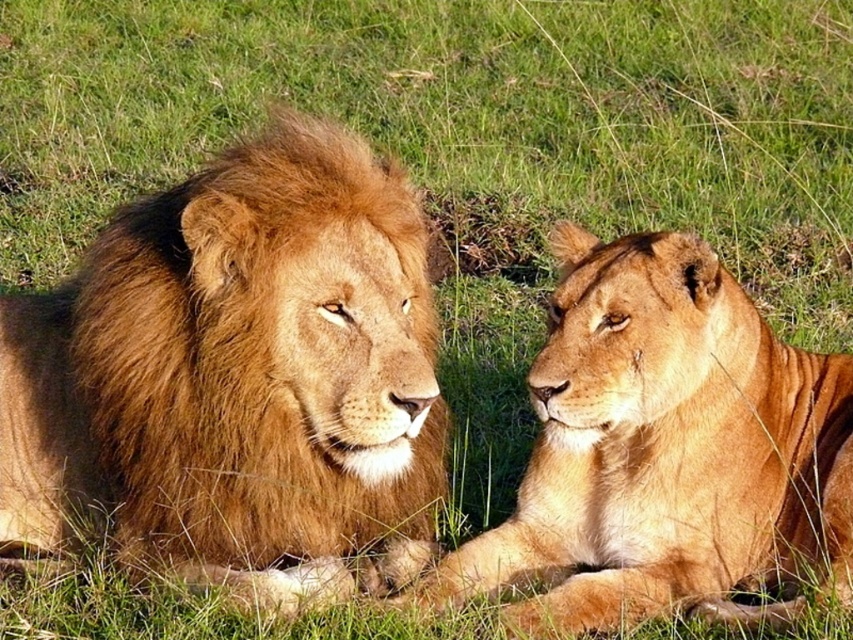
From the picture: You are standing in the savanna and see the golden fur lion at left. If you want to stay at least 3 meters away from it for safety, are you currently safe?

The golden fur lion at left and viewer are 2.37 meters apart from each other, so you are not safe because you are closer than the recommended 3 meters.

You are standing in the savanna and see two points marked in the image. Which point, point (115, 490) or point (726, 518), is nearer to you?

Point (115, 490) is closer to the viewer than point (726, 518).